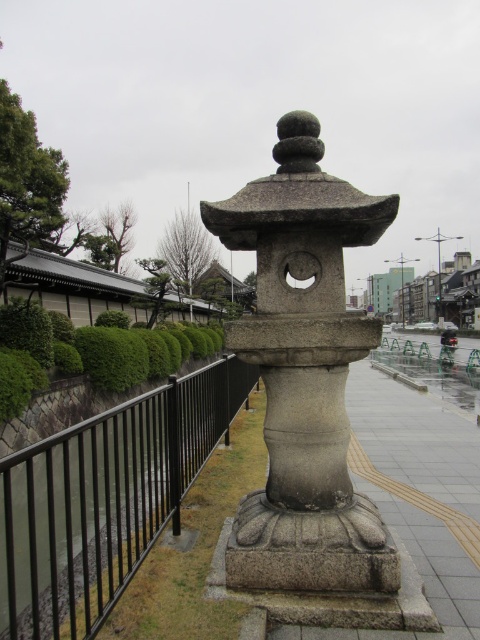
Who is shorter, black metal fence at left or green bushy hedge at left?

With less height is green bushy hedge at left.

Between black metal fence at left and green bushy hedge at left, which one has more height?

black metal fence at left

Is point (103, 518) less distant than point (78, 355)?

Yes, point (103, 518) is in front of point (78, 355).

You are a GUI agent. You are given a task and a screenshot of the screen. Output one action in this format:
    pyautogui.click(x=<x>, y=<y>)
    Task: Click on the black metal fence at left
    The width and height of the screenshot is (480, 640).
    Given the screenshot: What is the action you would take?
    pyautogui.click(x=105, y=499)

Find the location of `gray stone lantern at center`. gray stone lantern at center is located at coordinates (303, 372).

Who is more distant from viewer, (320,214) or (67,326)?

The point (67,326) is more distant.

Where is `gray stone lantern at center`? This screenshot has height=640, width=480. gray stone lantern at center is located at coordinates (303, 372).

Which of these two, gray stone lantern at center or black metal fence at left, stands shorter?

With less height is black metal fence at left.

At what (x,y) coordinates should I click in order to perform the action: click on gray stone lantern at center. Please return your answer as a coordinate pair (x, y). Looking at the image, I should click on (303, 372).